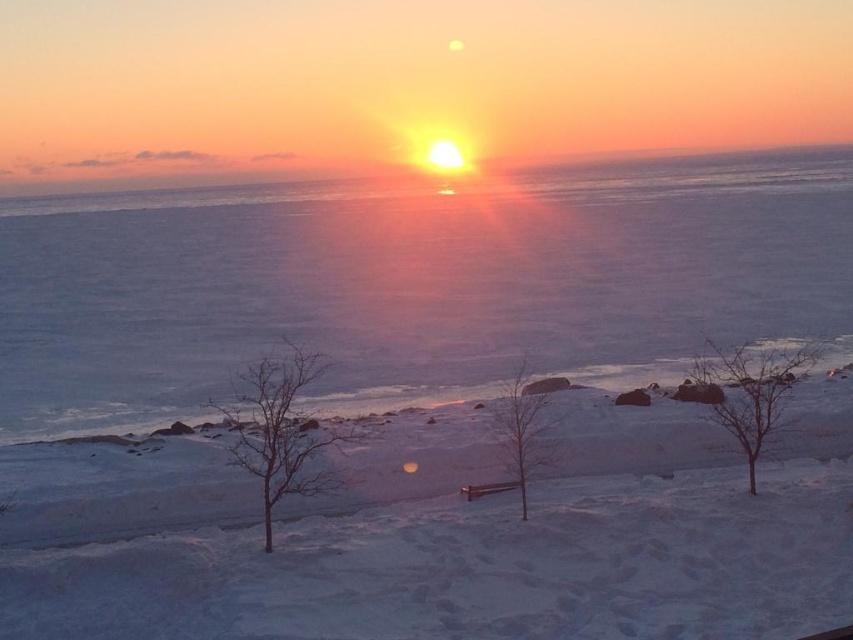
Does white powdery snow at center have a lesser width compared to bare tree at lower right?

Yes, white powdery snow at center is thinner than bare tree at lower right.

Which is behind, point (723, 637) or point (752, 477)?

The point (752, 477) is behind.

Locate an element on the screen. Image resolution: width=853 pixels, height=640 pixels. white powdery snow at center is located at coordinates (473, 547).

Is white powdery snow at center wider than bare wood tree at center?

Indeed, white powdery snow at center has a greater width compared to bare wood tree at center.

Between white powdery snow at center and bare wood tree at center, which one has less height?

white powdery snow at center is shorter.

Does point (109, 544) come farther from viewer compared to point (527, 451)?

Yes, it is behind point (527, 451).

Where is `white powdery snow at center`? The width and height of the screenshot is (853, 640). white powdery snow at center is located at coordinates (473, 547).

Between bare branches at center and bare tree at lower right, which one appears on the left side from the viewer's perspective?

From the viewer's perspective, bare branches at center appears more on the left side.

Which is in front, point (322, 490) or point (752, 438)?

Point (322, 490) is more forward.

At what (x,y) coordinates should I click in order to perform the action: click on bare branches at center. Please return your answer as a coordinate pair (x, y). Image resolution: width=853 pixels, height=640 pixels. Looking at the image, I should click on (279, 429).